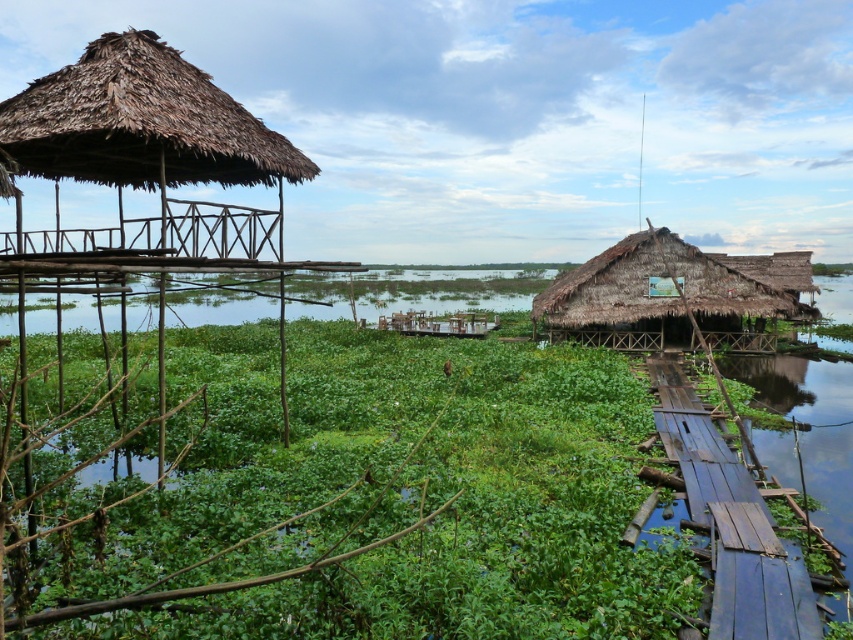
Consider the image. You are a tourist standing at the center of the wooden walkway on the right side of the image. You want to reach the thatched bamboo hut at left. Based on its 2D location coordinates, in which general direction should you walk to reach it?

The thatched bamboo hut at left is located at coordinates point (x=141, y=122), so you should walk towards the left direction to reach it.

You are planning to host a small gathering for 10 people. Based on the scene, which of the two huts, the thatched bamboo hut at left or the thatched straw hut at right, would be more suitable for accommodating everyone comfortably?

The thatched straw hut at right is larger in size compared to the thatched bamboo hut at left, making it more suitable for hosting a gathering of 10 people comfortably.